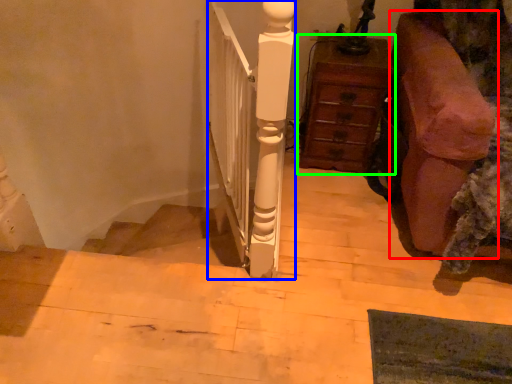
Question: Which object is the closest to the furniture (highlighted by a red box)? Choose among these: rail (highlighted by a blue box) or chest of drawers (highlighted by a green box).

Choices:
 (A) rail
 (B) chest of drawers

Answer: (B)